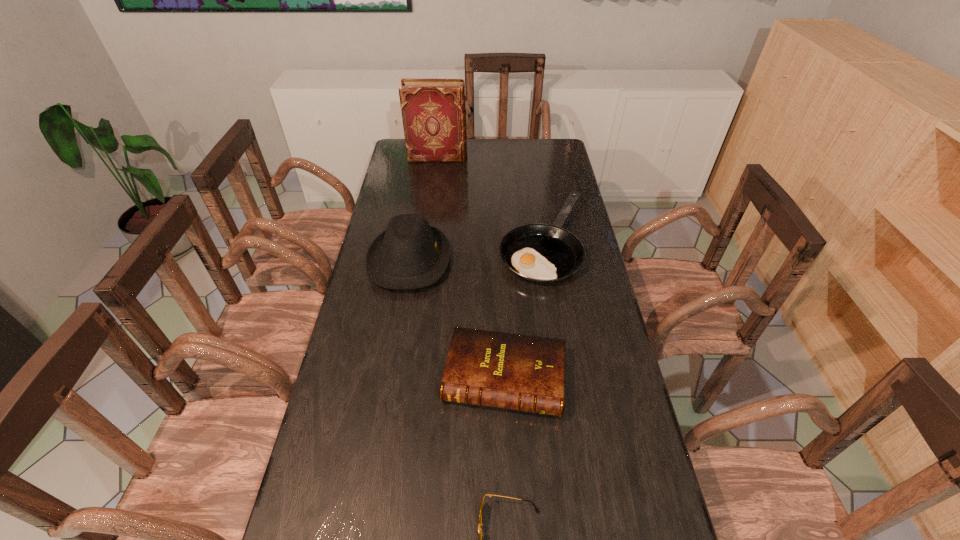
The image size is (960, 540). I want to click on object present at the far edge, so click(433, 111).

Find the location of a particular element. hardback book situated at the left edge is located at coordinates (433, 111).

Locate an element on the screen. Image resolution: width=960 pixels, height=540 pixels. fedora at the left edge is located at coordinates (410, 254).

Where is `frying pan that is at the right edge`? Image resolution: width=960 pixels, height=540 pixels. frying pan that is at the right edge is located at coordinates (543, 253).

Find the location of a particular element. Image resolution: width=960 pixels, height=540 pixels. hardback book situated at the right edge is located at coordinates [526, 373].

You are a GUI agent. You are given a task and a screenshot of the screen. Output one action in this format:
    pyautogui.click(x=<x>, y=<y>)
    Task: Click on the object at the far left corner
    The width and height of the screenshot is (960, 540).
    Given the screenshot: What is the action you would take?
    tap(433, 111)

At what (x,y) coordinates should I click in order to perform the action: click on vacant space at the far edge. Please return your answer as a coordinate pair (x, y). Looking at the image, I should click on (468, 163).

Locate an element on the screen. This screenshot has height=540, width=960. free spot at the left edge of the desktop is located at coordinates 388,195.

In the image, there is a desktop. Identify the location of vacant space at the right edge. (571, 400).

Where is `free space at the far left corner`? The image size is (960, 540). free space at the far left corner is located at coordinates (407, 163).